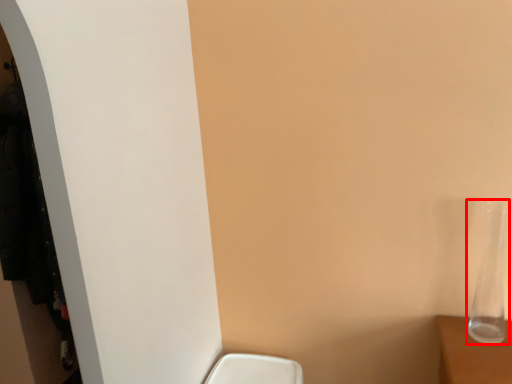
Question: From the image's perspective, what is the correct spatial relationship of glass vase (annotated by the red box) in relation to closet?

Choices:
 (A) below
 (B) above

Answer: (B)